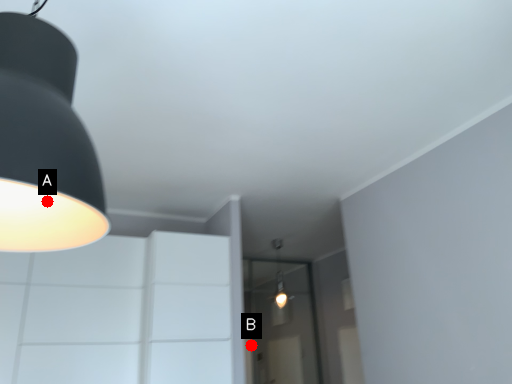
Question: Two points are circled on the image, labeled by A and B beside each circle. Which point appears farthest from the camera in this image?

Choices:
 (A) A is further
 (B) B is further

Answer: (B)